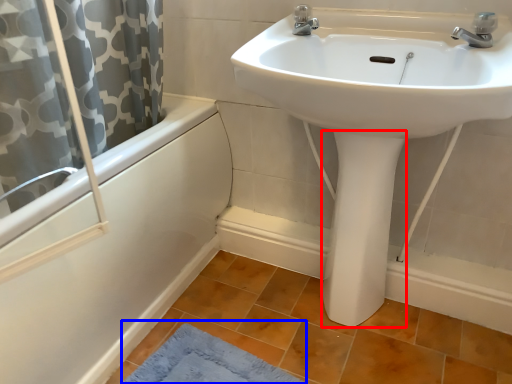
Question: Which object appears closest to the camera in this image, bidet (highlighted by a red box) or bath mat (highlighted by a blue box)?

Choices:
 (A) bidet
 (B) bath mat

Answer: (B)